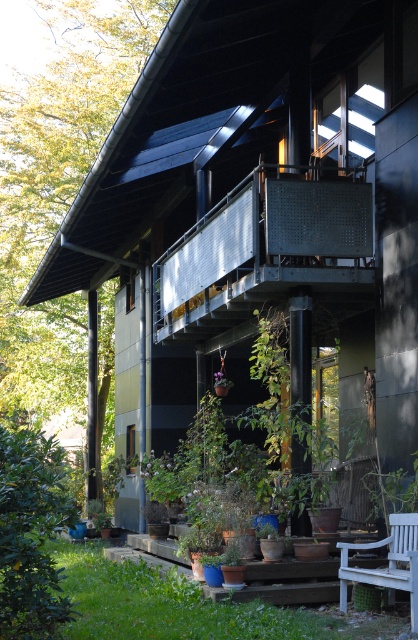
Question: From the image, what is the correct spatial relationship of rusty metal balcony at upper center in relation to white wooden bench at lower right?

Choices:
 (A) right
 (B) left

Answer: (B)

Question: Which point is closer to the camera?

Choices:
 (A) green leafy plant at lower left
 (B) white wooden bench at lower right

Answer: (A)

Question: Which of the following is the farthest from the observer?

Choices:
 (A) rusty metal balcony at upper center
 (B) white wooden bench at lower right
 (C) green leafy plant at lower left

Answer: (A)

Question: Among these points, which one is farthest from the camera?

Choices:
 (A) (176, 266)
 (B) (17, 506)
 (C) (394, 534)

Answer: (A)

Question: Is rusty metal balcony at upper center thinner than green leafy plant at lower left?

Choices:
 (A) no
 (B) yes

Answer: (B)

Question: Is rusty metal balcony at upper center thinner than green leafy plant at lower left?

Choices:
 (A) no
 (B) yes

Answer: (B)